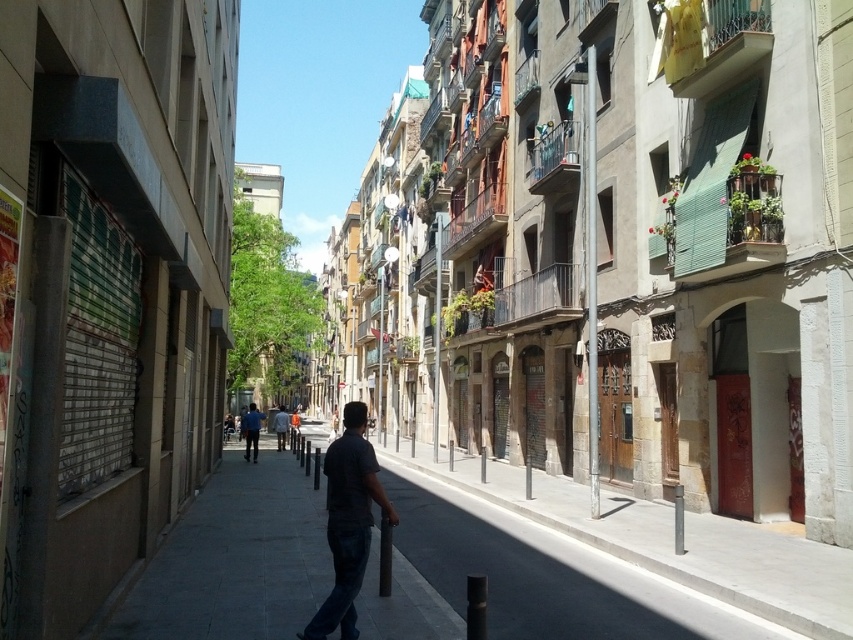
Question: Which point appears closest to the camera in this image?

Choices:
 (A) (338, 609)
 (B) (728, 568)

Answer: (A)

Question: Can you confirm if smooth concrete sidewalk at center is bigger than dark gray shirt at center?

Choices:
 (A) no
 (B) yes

Answer: (B)

Question: Observing the image, what is the correct spatial positioning of smooth concrete sidewalk at center in reference to dark gray shirt at center?

Choices:
 (A) right
 (B) left

Answer: (A)

Question: Which point is farther from the camera taking this photo?

Choices:
 (A) (364, 547)
 (B) (567, 480)

Answer: (B)

Question: Can you confirm if smooth concrete sidewalk at center is positioned to the left of dark gray shirt at center?

Choices:
 (A) no
 (B) yes

Answer: (A)

Question: Which point appears farthest from the camera in this image?

Choices:
 (A) (354, 570)
 (B) (727, 589)

Answer: (B)